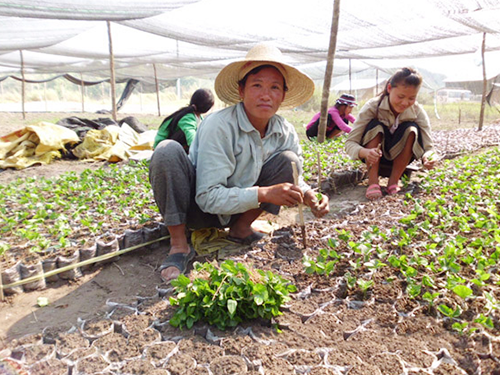
Identify the location of cloth. Image resolution: width=500 pixels, height=375 pixels. (110, 150).